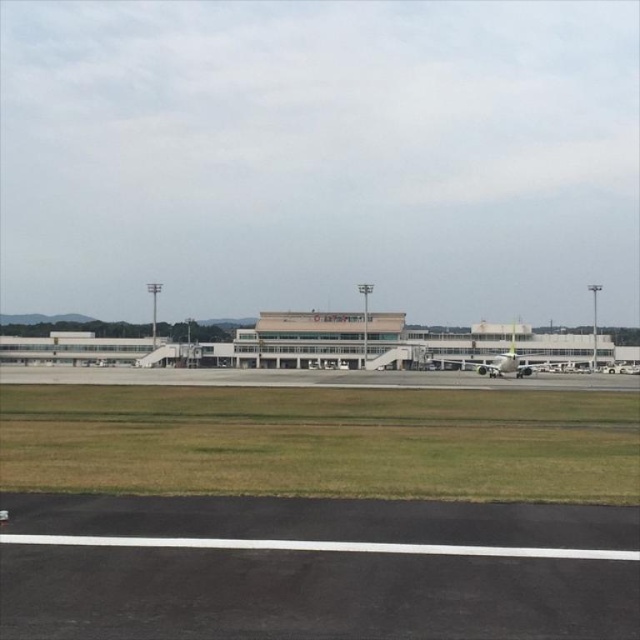
Question: From the image, what is the correct spatial relationship of black asphalt tarmac at lower center in relation to white glossy airplane at center?

Choices:
 (A) left
 (B) right

Answer: (A)

Question: Observing the image, what is the correct spatial positioning of black asphalt tarmac at lower center in reference to white glossy airplane at center?

Choices:
 (A) right
 (B) left

Answer: (B)

Question: Does black asphalt tarmac at lower center appear on the right side of white glossy airplane at center?

Choices:
 (A) yes
 (B) no

Answer: (B)

Question: Which object appears farthest from the camera in this image?

Choices:
 (A) white glossy airplane at center
 (B) black asphalt tarmac at lower center

Answer: (A)